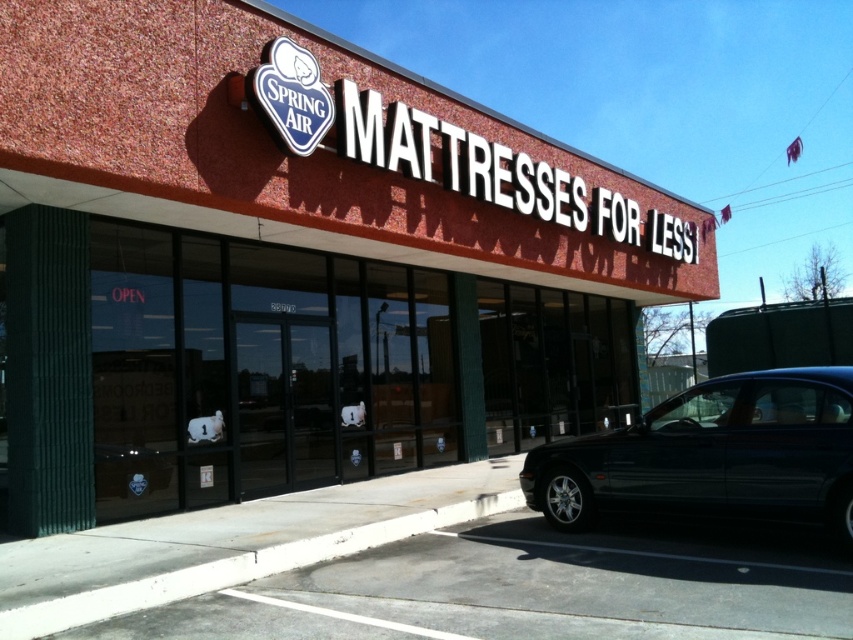
You are standing in front of the Spring Air Mattresses for Less store. If you were to draw a map of the store location, what coordinates would you use to mark the center of the red brick building at center?

The center of the red brick building at center should be marked at coordinates point (293, 264).

You are a delivery person with a truck that is 7 meters long. You need to park your truck between the red brick building at center and the shiny dark blue sedan at lower right. Is there enough space for your truck to fit between them?

The distance between the red brick building at center and the shiny dark blue sedan at lower right is 6.67 meters. Since the truck is 7 meters long, it is slightly too long to fit between them. You would need to find a different parking spot.

You are a customer approaching the Spring Air Mattresses for Less store. You see the red brick building at center and the shiny dark blue sedan at lower right. Which object is closer to you as you approach the store?

The red brick building at center is closer to you because it is in front of the shiny dark blue sedan at lower right.